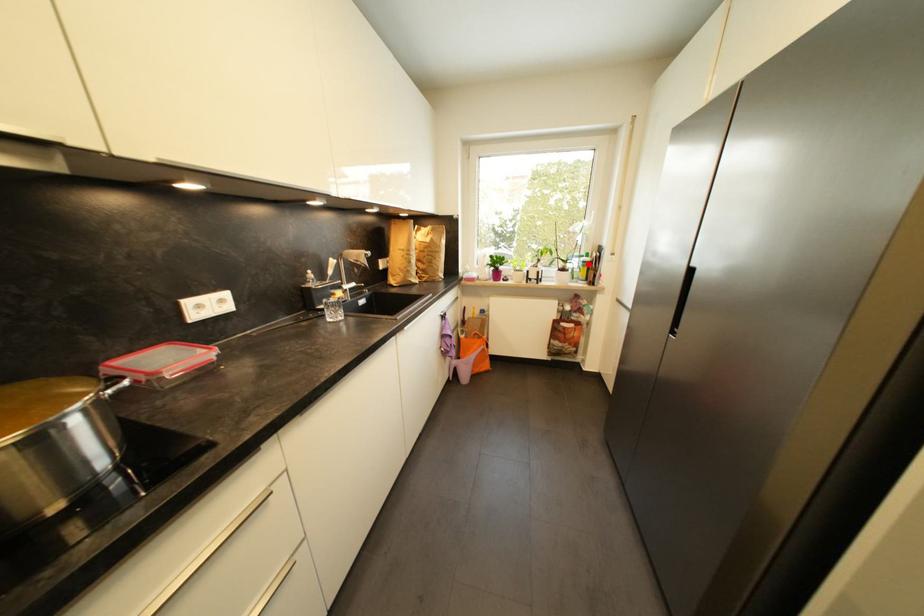
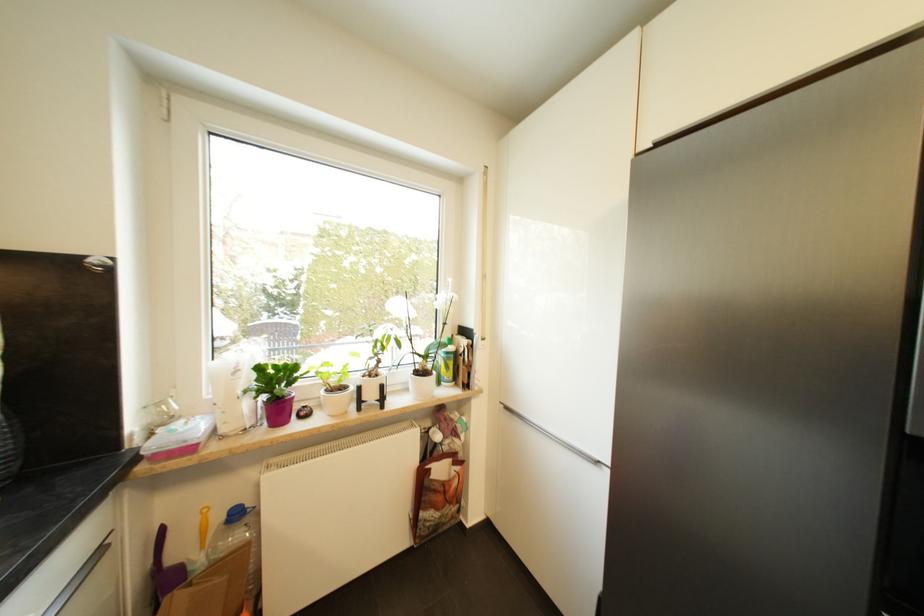
Find the pixel in the second image that matches the highlighted location in the first image.

(453, 355)